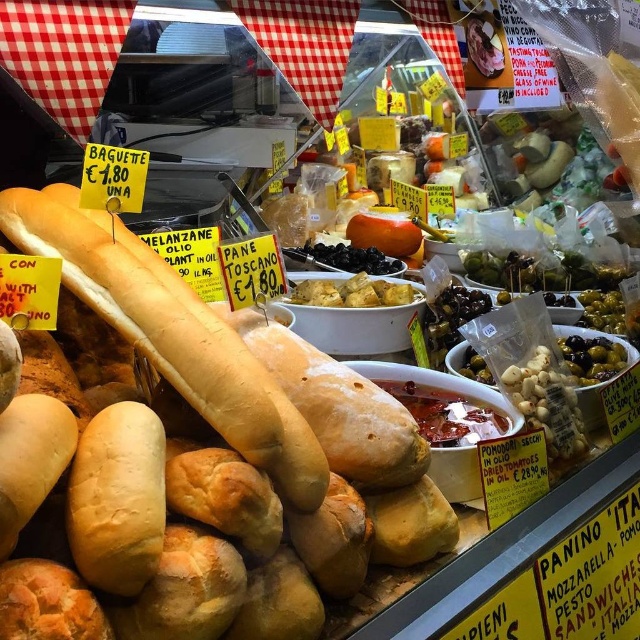
Can you confirm if golden brown crusty baguette at center is thinner than golden brown croutons at center?

In fact, golden brown crusty baguette at center might be wider than golden brown croutons at center.

Between point (88, 241) and point (314, 296), which one is positioned behind?

The point (314, 296) is behind.

Is point (205, 328) behind point (317, 296)?

No.

You are a GUI agent. You are given a task and a screenshot of the screen. Output one action in this format:
    pyautogui.click(x=<x>, y=<y>)
    Task: Click on the golden brown crusty baguette at center
    
    Given the screenshot: What is the action you would take?
    [172, 332]